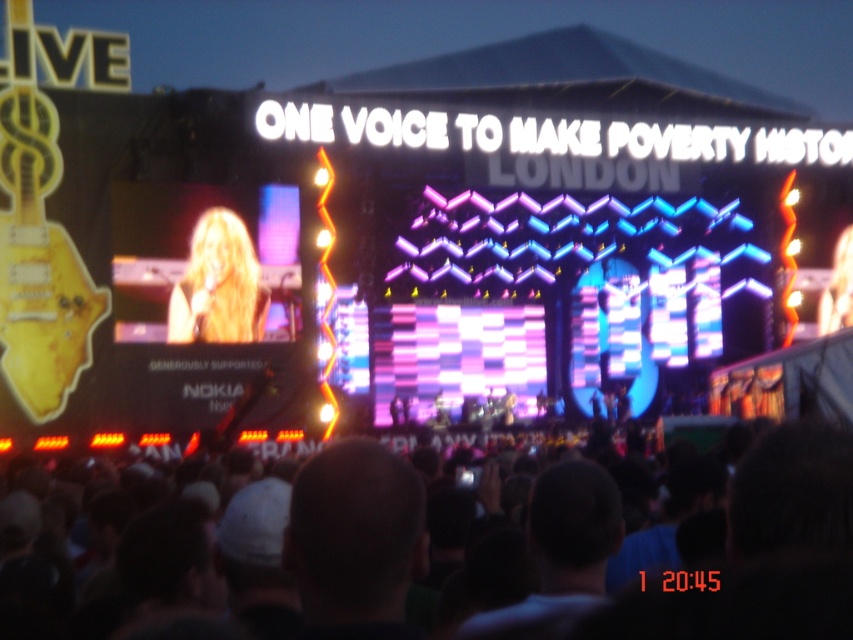
Question: Which point is closer to the camera?

Choices:
 (A) (236, 333)
 (B) (253, 326)

Answer: (A)

Question: Is blonde hair at left smaller than blonde hair at center?

Choices:
 (A) no
 (B) yes

Answer: (A)

Question: Which object appears farthest from the camera in this image?

Choices:
 (A) blonde hair at left
 (B) blonde hair at center
 (C) dark hair at center

Answer: (B)

Question: Among these points, which one is farthest from the camera?

Choices:
 (A) (293, 264)
 (B) (653, 596)
 (C) (223, 227)

Answer: (A)

Question: Can you confirm if dark hair at center is positioned to the right of blonde hair at center?

Choices:
 (A) yes
 (B) no

Answer: (A)

Question: Does dark hair at center appear on the right side of blonde hair at center?

Choices:
 (A) no
 (B) yes

Answer: (B)